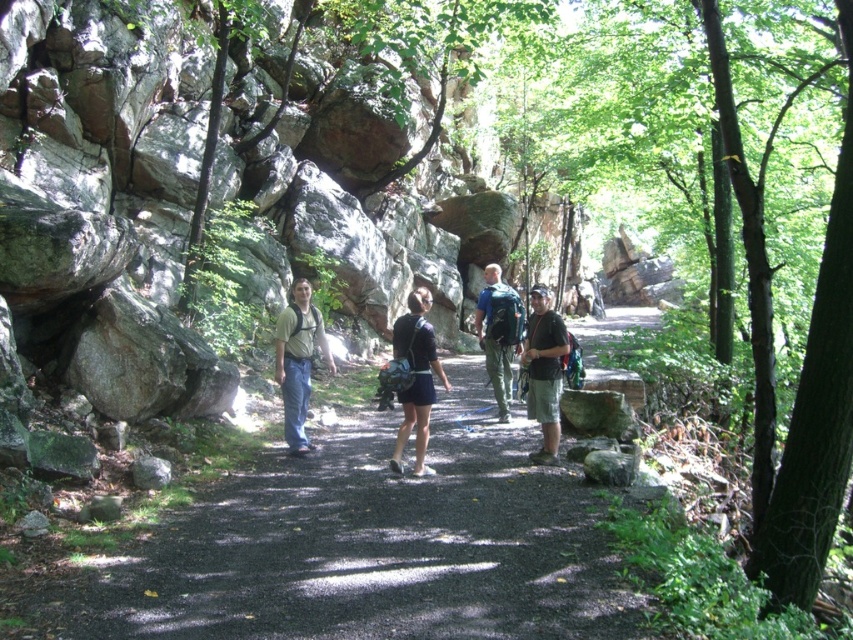
Between matte khaki shirt at center and matte black backpack at center, which one appears on the left side from the viewer's perspective?

matte khaki shirt at center

Does matte khaki shirt at center have a smaller size compared to matte black backpack at center?

No, matte khaki shirt at center is not smaller than matte black backpack at center.

Which is in front, point (276, 346) or point (433, 397)?

Point (433, 397) is more forward.

Identify the location of matte khaki shirt at center. The image size is (853, 640). (299, 360).

Who is more forward, [303,300] or [508,292]?

Positioned in front is point [303,300].

Between matte khaki shirt at center and matte green backpack at center, which one has more height?

matte khaki shirt at center

The image size is (853, 640). Find the location of `matte khaki shirt at center`. matte khaki shirt at center is located at coordinates (299, 360).

Can you confirm if black asphalt path at center is shorter than camouflage shorts at center?

Yes.

What do you see at coordinates (364, 547) in the screenshot? This screenshot has width=853, height=640. I see `black asphalt path at center` at bounding box center [364, 547].

Where is `black asphalt path at center`? The width and height of the screenshot is (853, 640). black asphalt path at center is located at coordinates click(x=364, y=547).